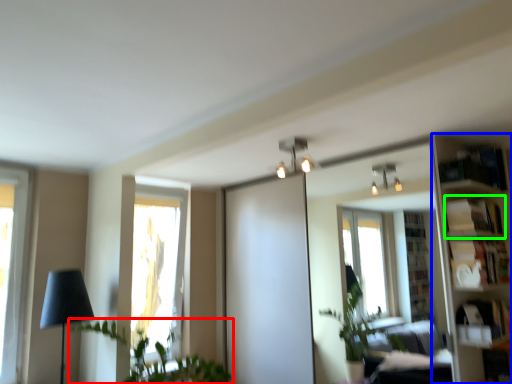
Question: Which is farther away from houseplant (highlighted by a red box)? bookshelf (highlighted by a blue box) or shelf (highlighted by a green box)?

Choices:
 (A) bookshelf
 (B) shelf

Answer: (B)